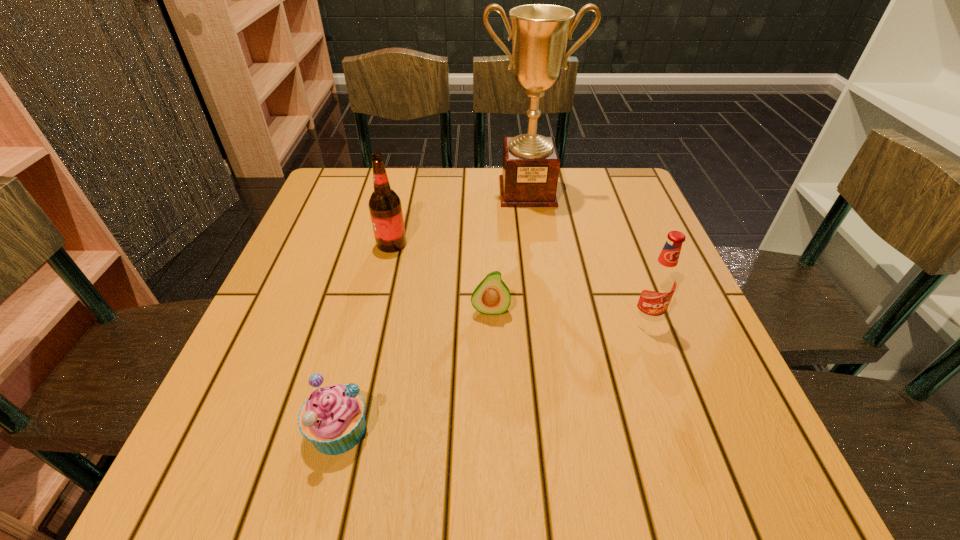
Image resolution: width=960 pixels, height=540 pixels. What are the coordinates of `unoccupied position between the nearer root beer and the trophy cup` in the screenshot? It's located at (587, 255).

You are a GUI agent. You are given a task and a screenshot of the screen. Output one action in this format:
    pyautogui.click(x=<x>, y=<y>)
    Task: Click on the vacant area that lies between the trophy cup and the left root beer
    This screenshot has height=540, width=960.
    Given the screenshot: What is the action you would take?
    [x=460, y=218]

What are the coordinates of `unoccupied position between the nearest object and the avocado` in the screenshot? It's located at (415, 369).

Select which object is the second closest to the nearest object. Please provide its 2D coordinates. Your answer should be formatted as a tuple, i.e. [(x, y)], where the tuple contains the x and y coordinates of a point satisfying the conditions above.

[(385, 207)]

Locate an element on the screen. object that is the fourth closest to the left root beer is located at coordinates (660, 281).

The width and height of the screenshot is (960, 540). I want to click on free space in the image that satisfies the following two spatial constraints: 1. on the plaque of the rightmost object; 2. on the right side of the farthest object, so click(x=546, y=320).

The image size is (960, 540). Identify the location of vacant space that satisfies the following two spatial constraints: 1. on the back side of the muffin; 2. on the left side of the right root beer. (366, 320).